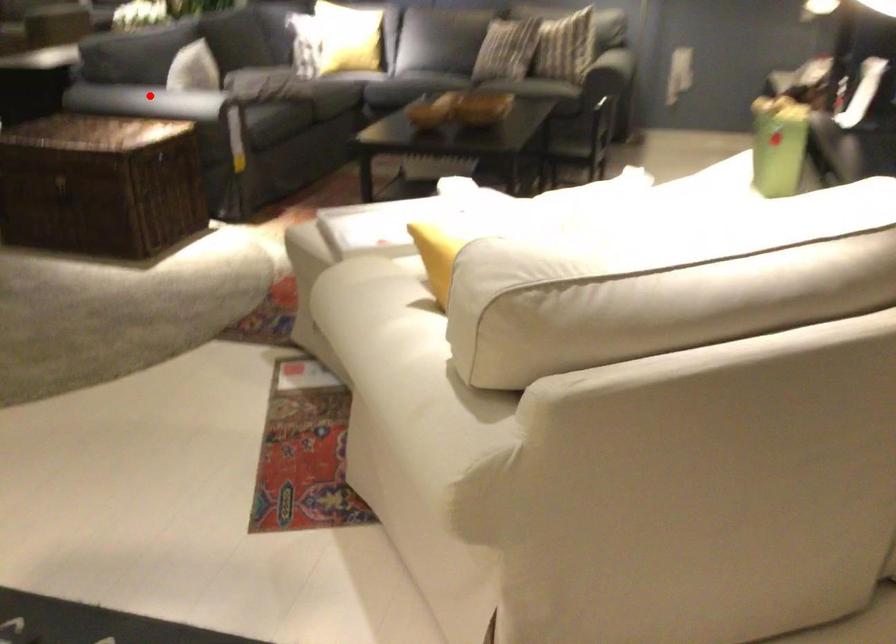
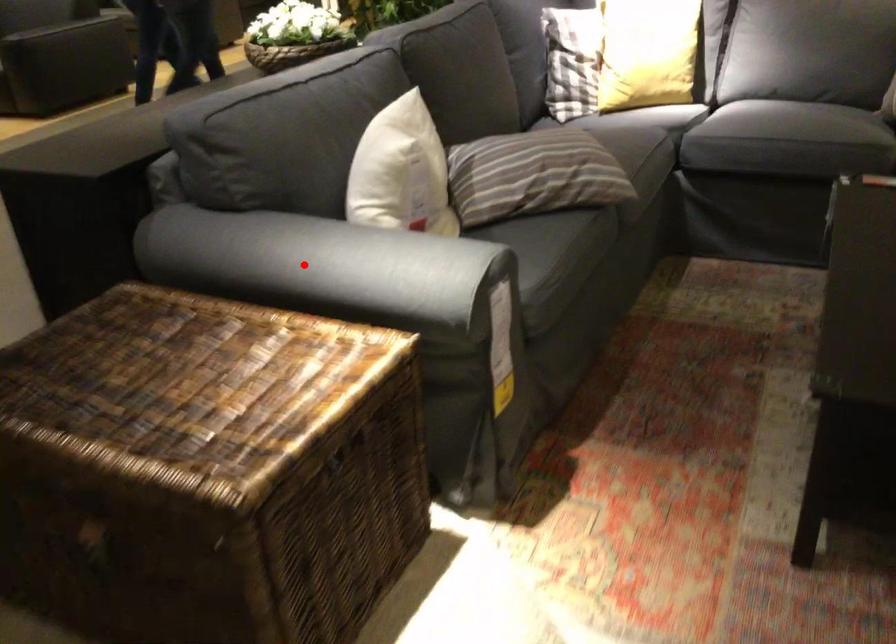
I am providing you with two images of the same scene from different viewpoints. A red point is marked on the first image and another point is marked on the second image. Is the marked point in image1 the same physical position as the marked point in image2?

Yes